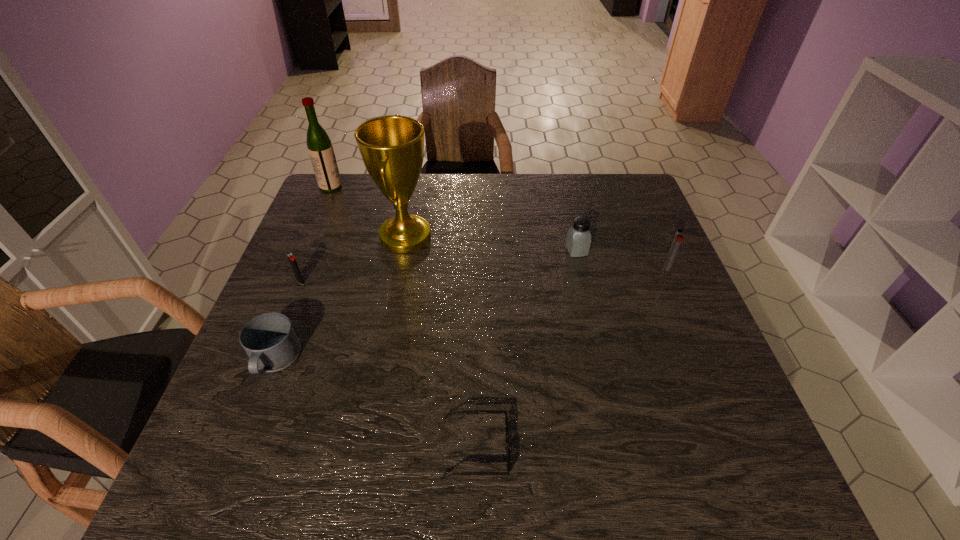
This screenshot has height=540, width=960. I want to click on object that is at the near edge, so click(507, 449).

I want to click on liquor located at the left edge, so click(320, 148).

Identify the location of igniter present at the left edge. The image size is (960, 540). (291, 258).

This screenshot has height=540, width=960. Find the location of `mug located in the left edge section of the desktop`. mug located in the left edge section of the desktop is located at coordinates pos(269,339).

Where is `object present at the right edge`? Image resolution: width=960 pixels, height=540 pixels. object present at the right edge is located at coordinates (677, 240).

Find the location of a particular element. The image size is (960, 540). object that is at the far left corner is located at coordinates (320, 148).

The image size is (960, 540). Identify the location of free location at the far edge of the desktop. (475, 215).

The height and width of the screenshot is (540, 960). What are the coordinates of `free space at the near edge` in the screenshot? It's located at (413, 465).

At what (x,y) coordinates should I click in order to perform the action: click on free location at the left edge of the desktop. Please return your answer as a coordinate pair (x, y). This screenshot has width=960, height=540. Looking at the image, I should click on (309, 237).

This screenshot has height=540, width=960. In the image, there is a desktop. Find the location of `free space at the right edge`. free space at the right edge is located at coordinates [624, 219].